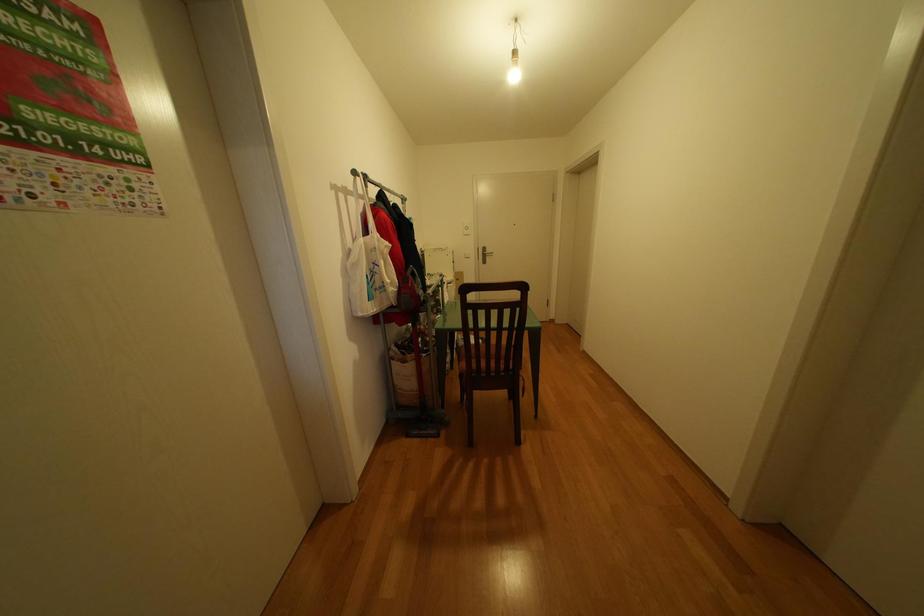
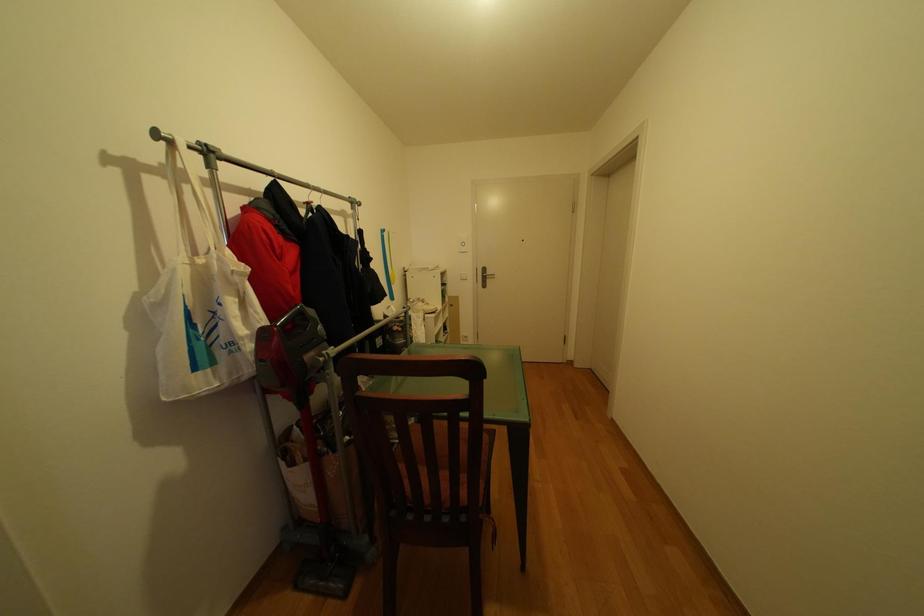
Question: The camera is either moving clockwise (left) or counter-clockwise (right) around the object. The first image is from the beginning of the video and the second image is from the end. Is the camera moving left or right when shooting the video?

Choices:
 (A) Left
 (B) Right

Answer: (B)